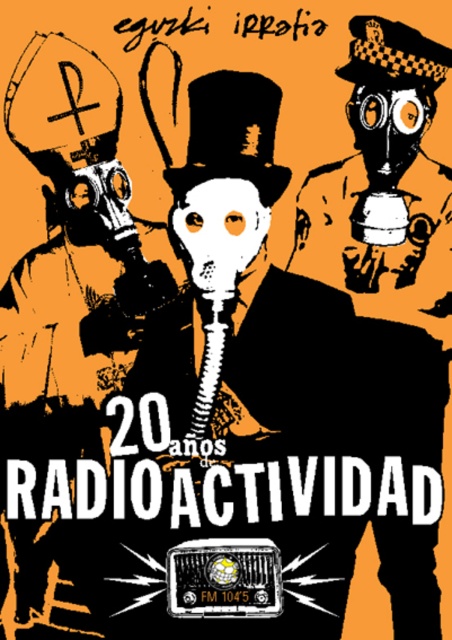
You are designing a poster and need to place two matte black gas masks on either side of a central element. The central element requires a minimum of 20 inches of space. Given the distance between the matte black gas mask at left and the black matte gas mask at right, will the central element fit?

The distance between the matte black gas mask at left and the black matte gas mask at right is 23.21 inches, which is more than the required 20 inches. Therefore, the central element will fit between them.

Which object is located at the coordinates point (65, 320)?

The point (65, 320) corresponds to the matte black gas mask at left.